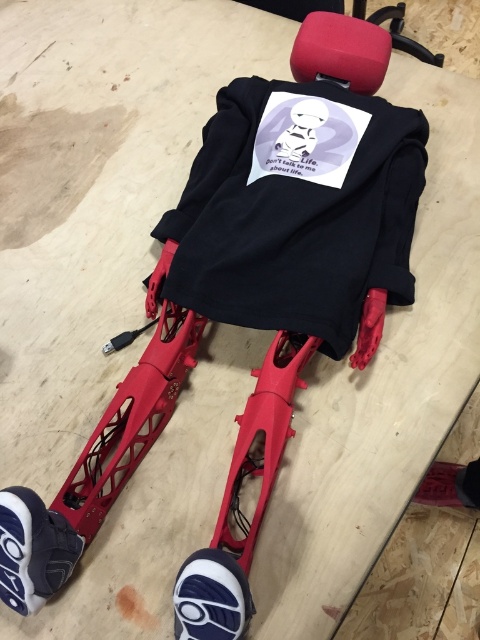
You are organizing a closet and need to place the black matte sweatshirt at center and the dark gray rubber shoe at lower left into storage. Which item requires more space due to its size?

The black matte sweatshirt at center requires more space because it has a larger size compared to the dark gray rubber shoe at lower left.

You are a delivery robot with a 12 inch wide package. You need to place it between the black matte sweatshirt at center and the white textured shoe at lower left. Is there enough space?

The black matte sweatshirt at center and white textured shoe at lower left are 20.93 inches apart from each other. Since the package is 12 inches wide, there is enough space to place it between them.

You are trying to decide whether to place a new rectangular box on the floor between the black matte sweatshirt at center and the white textured shoe at lower left. The box is 15 cm in width. Can you determine if there is enough space between them to fit the box?

The black matte sweatshirt at center might be wider than white textured shoe at lower left, so there might not be enough space between them to fit a 15 cm wide box.